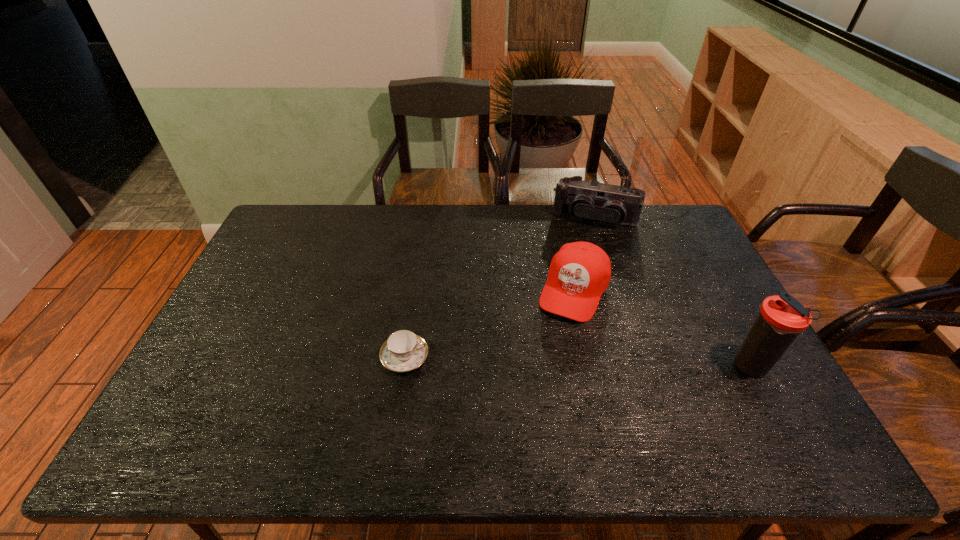
Where is `vacant space at the left edge of the desktop`? Image resolution: width=960 pixels, height=540 pixels. vacant space at the left edge of the desktop is located at coordinates (227, 359).

Locate an element on the screen. The height and width of the screenshot is (540, 960). vacant space at the far left corner of the desktop is located at coordinates (303, 232).

What are the coordinates of `free spot at the far right corner of the desktop` in the screenshot? It's located at (670, 224).

The image size is (960, 540). Identify the location of free space at the near right corner of the desktop. (786, 410).

What are the coordinates of `vacant point located between the tallest object and the baseball cap` in the screenshot? It's located at (662, 328).

The image size is (960, 540). Identify the location of vacant point located between the leftmost object and the camcorder. (499, 288).

This screenshot has height=540, width=960. In order to click on blank region between the baseball cap and the shortest object in this screenshot , I will do `click(490, 323)`.

The height and width of the screenshot is (540, 960). In order to click on unoccupied area between the baseball cap and the shortest object in this screenshot , I will do `click(490, 323)`.

Identify the location of empty space between the thermos bottle and the shortest object. This screenshot has width=960, height=540. (578, 362).

Locate an element on the screen. Image resolution: width=960 pixels, height=540 pixels. vacant area that lies between the thermos bottle and the shortest object is located at coordinates (578, 362).